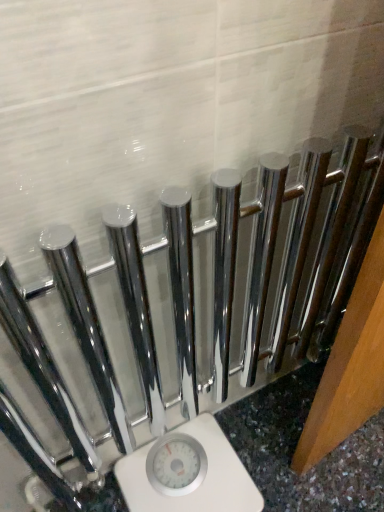
At what (x,y) coordinates should I click in order to perform the action: click on vacant area on top of white plastic scale at lower center (from a real-world perspective). Please return your answer as a coordinate pair (x, y). The image size is (384, 512). Looking at the image, I should click on (182, 471).